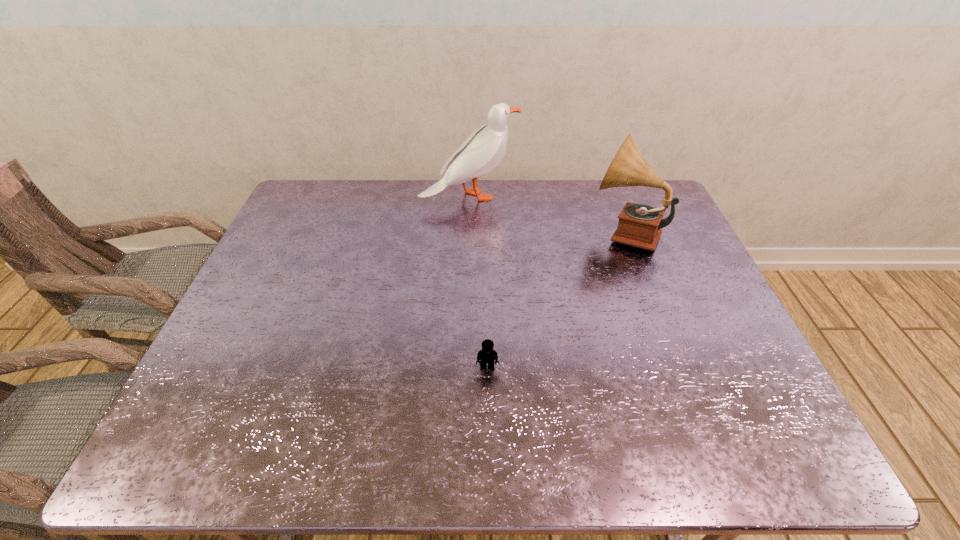
Image resolution: width=960 pixels, height=540 pixels. I want to click on phonograph record located at the far edge, so click(639, 225).

Where is `object that is at the right edge`? object that is at the right edge is located at coordinates (639, 225).

What are the coordinates of `object present at the far right corner` in the screenshot? It's located at (639, 225).

I want to click on free location at the far edge of the desktop, so click(x=590, y=181).

This screenshot has height=540, width=960. Identify the location of free space at the near edge. (670, 458).

Identify the location of vacant area at the left edge of the desktop. (259, 362).

Find the location of a particular element. vacant space at the right edge of the desktop is located at coordinates (702, 316).

Locate an element on the screen. The height and width of the screenshot is (540, 960). vacant point at the far left corner is located at coordinates (329, 195).

The image size is (960, 540). What are the coordinates of `free spot between the shortest object and the gull` in the screenshot? It's located at (478, 282).

Where is `free area in between the phonograph record and the gull`? This screenshot has width=960, height=540. free area in between the phonograph record and the gull is located at coordinates (547, 214).